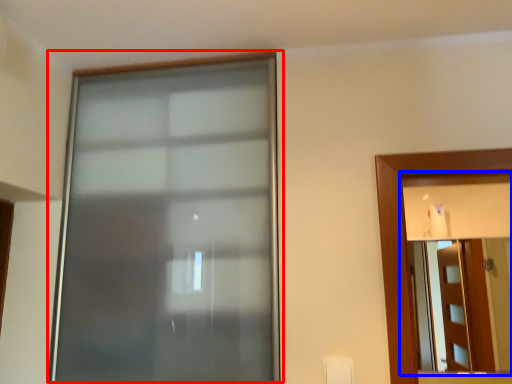
Question: Which object appears farthest to the camera in this image, window (highlighted by a red box) or mirror (highlighted by a blue box)?

Choices:
 (A) window
 (B) mirror

Answer: (B)